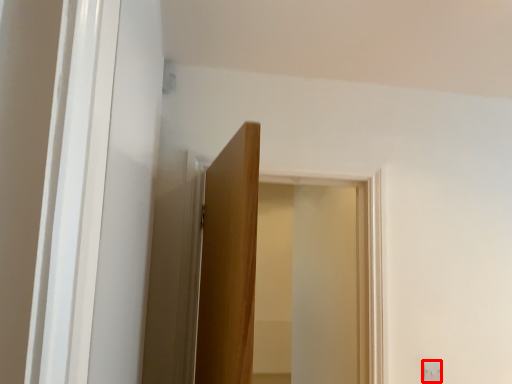
Question: From the image's perspective, considering the relative positions of light switch (annotated by the red box) and window in the image provided, where is light switch (annotated by the red box) located with respect to the staircase?

Choices:
 (A) below
 (B) above

Answer: (A)